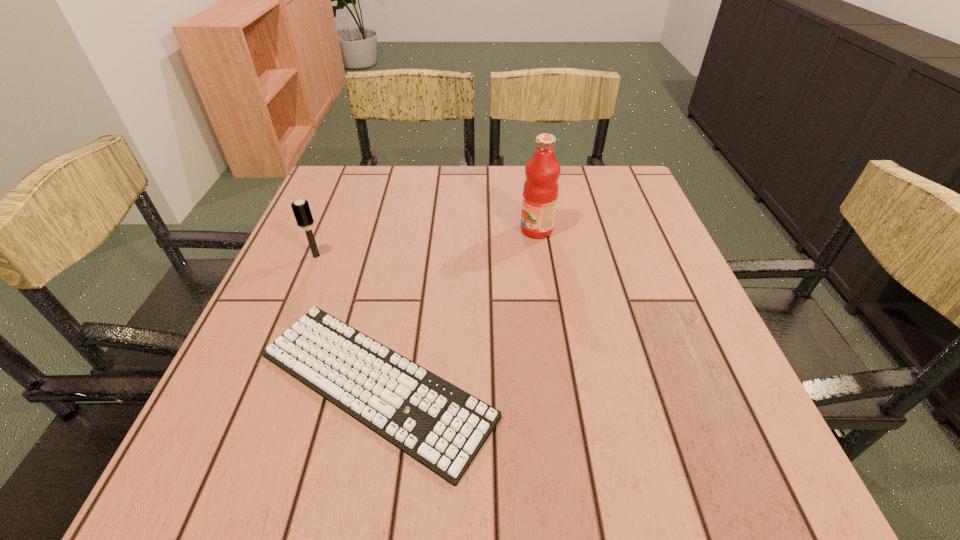
Identify the location of fruit juice. (540, 191).

Where is `the farthest object`? Image resolution: width=960 pixels, height=540 pixels. the farthest object is located at coordinates coord(540,191).

Where is `the second farthest object`? The height and width of the screenshot is (540, 960). the second farthest object is located at coordinates (301, 209).

You are a GUI agent. You are given a task and a screenshot of the screen. Output one action in this format:
    pyautogui.click(x=<x>, y=<y>)
    Task: Click on the second tallest object
    The height and width of the screenshot is (540, 960).
    Given the screenshot: What is the action you would take?
    pyautogui.click(x=301, y=209)

Find the location of `the shortest object`. the shortest object is located at coordinates (441, 426).

Find the location of a particular element. The height and width of the screenshot is (540, 960). the nearest object is located at coordinates (441, 426).

In order to click on free region located 0.180m on the front label of the rightmost object in this screenshot , I will do `click(446, 230)`.

Locate an element on the screen. The height and width of the screenshot is (540, 960). free space located on the front label of the rightmost object is located at coordinates (419, 230).

Locate an element on the screen. This screenshot has width=960, height=540. vacant space located 0.060m on the front label of the rightmost object is located at coordinates (495, 230).

This screenshot has height=540, width=960. Find the location of `vacant position located on the right of the second nearest object`. vacant position located on the right of the second nearest object is located at coordinates (424, 256).